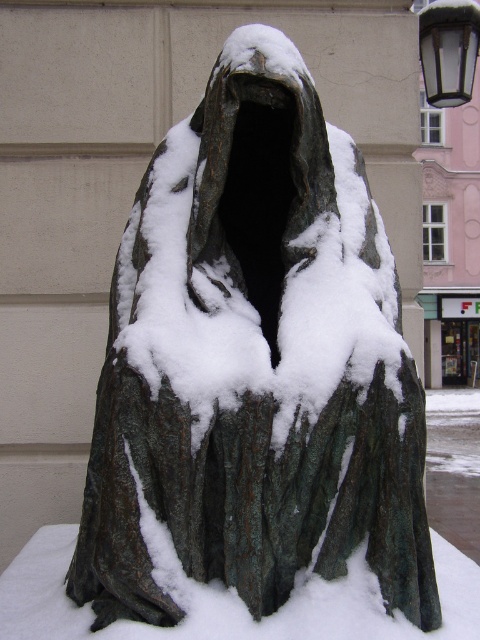
Question: Where is white frosty snow at center located in relation to metallic glass lamp at upper right in the image?

Choices:
 (A) above
 (B) below

Answer: (B)

Question: Which point is farther from the camera taking this photo?

Choices:
 (A) (423, 17)
 (B) (434, 540)

Answer: (A)

Question: Which point is closer to the camera taking this photo?

Choices:
 (A) (19, 609)
 (B) (430, 77)

Answer: (A)

Question: From the image, what is the correct spatial relationship of white frosty snow at center in relation to metallic glass lamp at upper right?

Choices:
 (A) below
 (B) above

Answer: (A)

Question: Can you confirm if white frosty snow at center is bigger than metallic glass lamp at upper right?

Choices:
 (A) no
 (B) yes

Answer: (B)